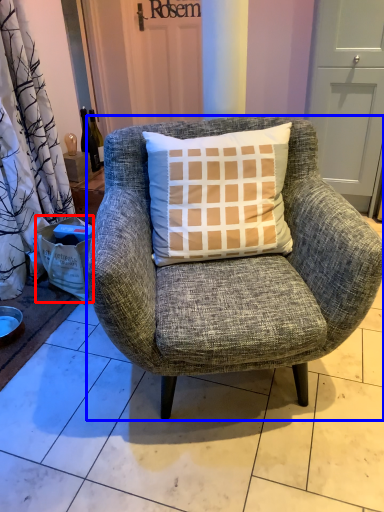
Question: Which point is further to the camera, box (highlighted by a red box) or chair (highlighted by a blue box)?

Choices:
 (A) box
 (B) chair

Answer: (A)